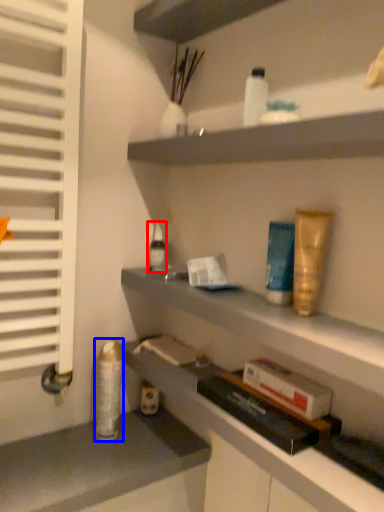
Question: Which point is further to the camera, toiletry (highlighted by a red box) or toiletry (highlighted by a blue box)?

Choices:
 (A) toiletry
 (B) toiletry

Answer: (A)